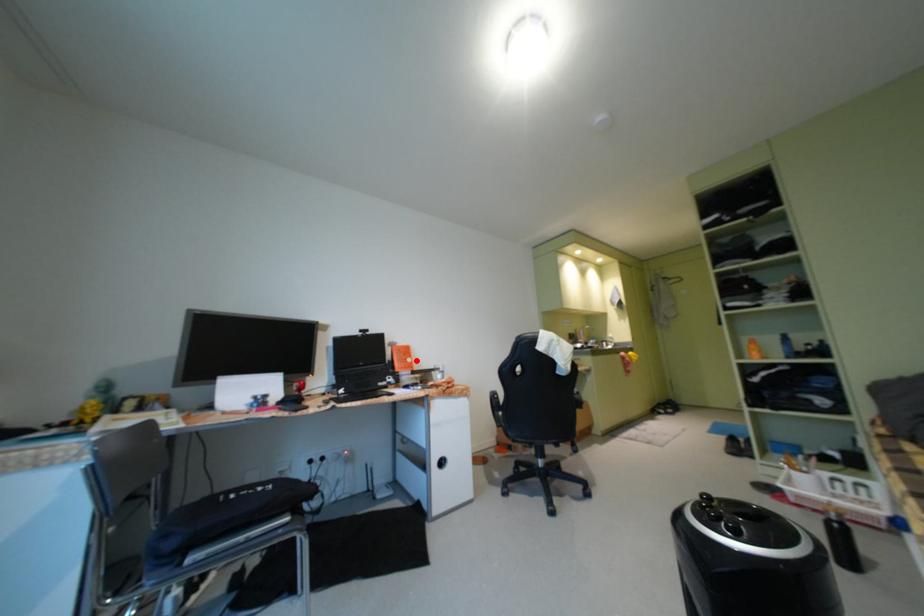
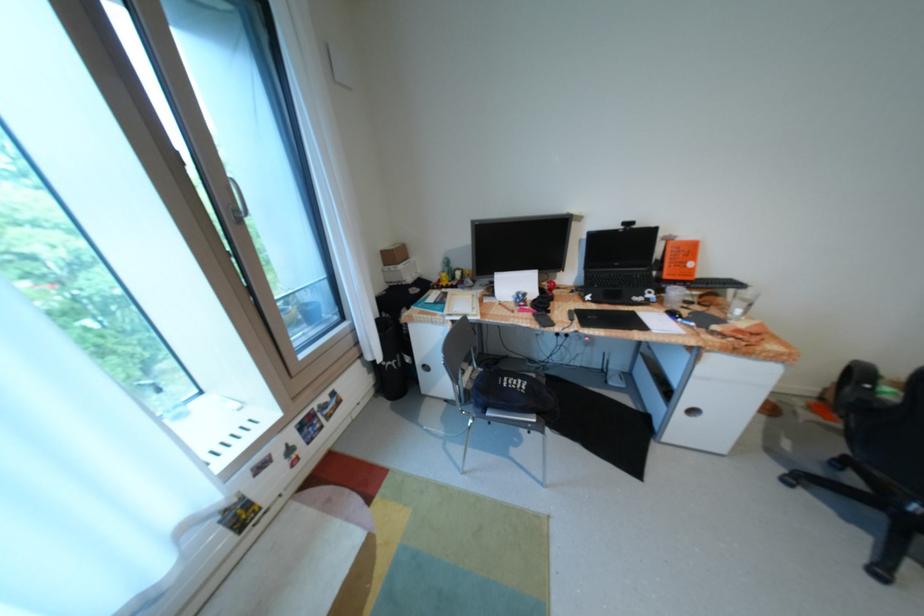
In the second image, find the point that corresponds to the highlighted location in the first image.

(697, 264)